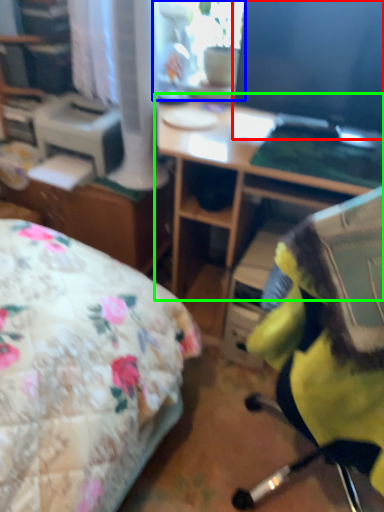
Question: Based on their relative distances, which object is farther from computer monitor (highlighted by a red box)? Choose from window screen (highlighted by a blue box) and desk (highlighted by a green box).

Choices:
 (A) window screen
 (B) desk

Answer: (A)